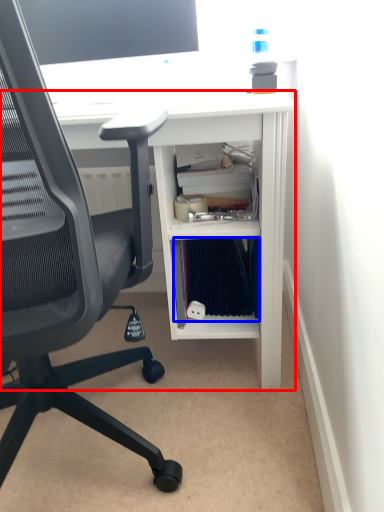
Question: Which object appears closest to the camera in this image, desk (highlighted by a red box) or binder (highlighted by a blue box)?

Choices:
 (A) desk
 (B) binder

Answer: (A)